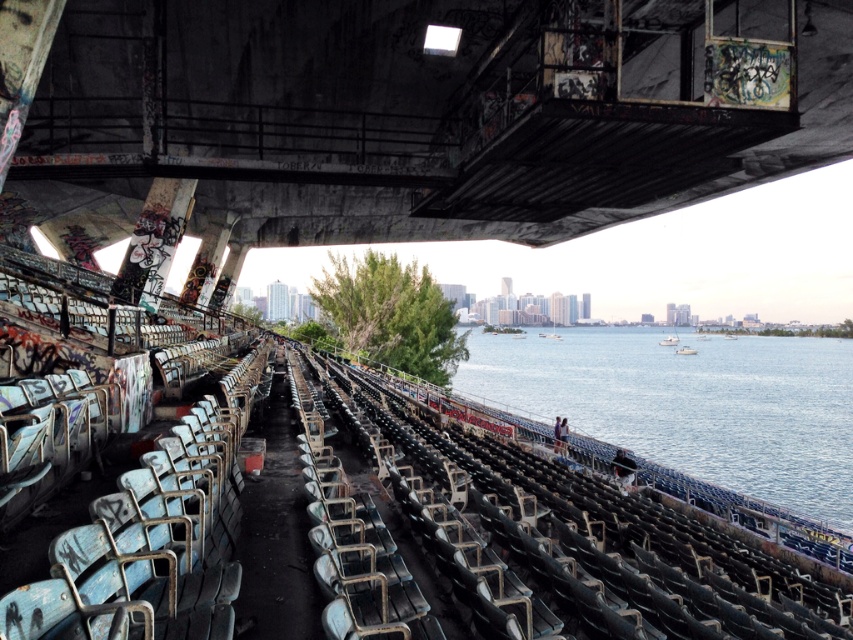
You are standing at the point closest to the city skyline in the abandoned stadium. Which of the two points, point (134, 179) or point (566, 572), is farther away from you?

Point (134, 179) is behind point (566, 572), so if you are standing at the point closest to the city skyline, point (134, 179) is farther away from you.

You are a photographer wanting to capture the city skyline through the concrete textured overpass at upper center and the blue water at center. Which object would allow you to see the skyline more clearly, the thinner one or the wider one?

The concrete textured overpass at upper center is thinner than the blue water at center, so the thinner concrete textured overpass at upper center would allow you to see the skyline more clearly since it has less obstruction.